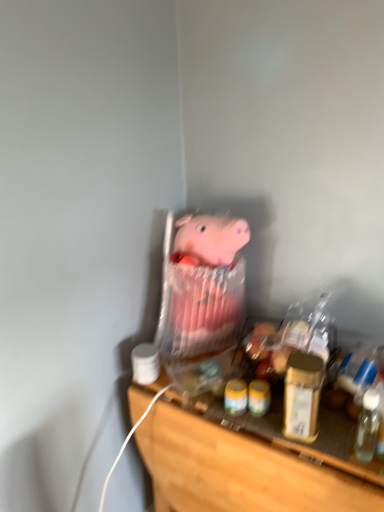
Where is `free spot to the left of gold metallic jar at right`? This screenshot has height=512, width=384. free spot to the left of gold metallic jar at right is located at coordinates (264, 428).